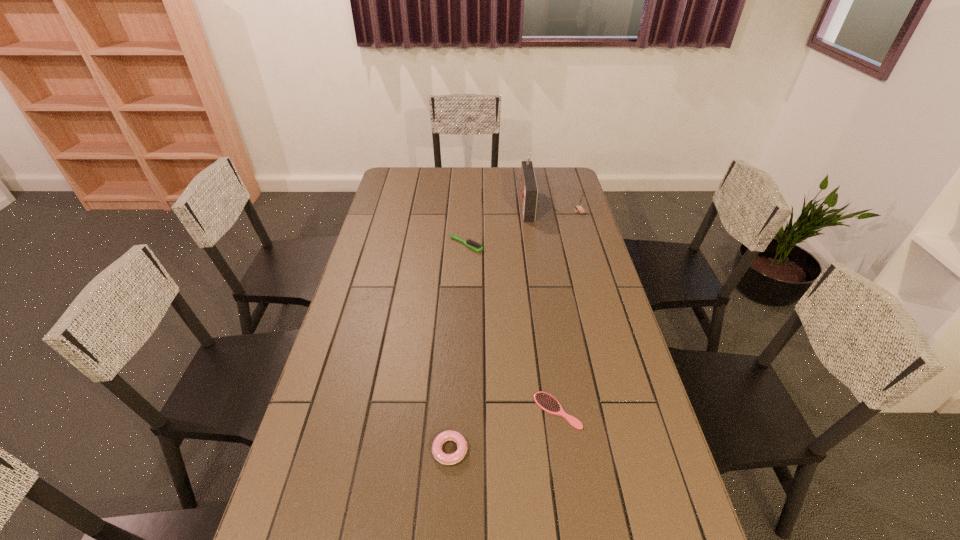
Where is `radio receiver`? radio receiver is located at coordinates (528, 187).

I want to click on matchbox, so click(x=579, y=207).

The image size is (960, 540). I want to click on the fourth shortest object, so click(x=579, y=207).

In order to click on the farther hairbrush in this screenshot , I will do 469,243.

Locate an element on the screen. The width and height of the screenshot is (960, 540). the third nearest object is located at coordinates (469, 243).

Locate an element on the screen. the nearest object is located at coordinates (448, 459).

Identify the location of the shortest object. The height and width of the screenshot is (540, 960). (545, 401).

Find the location of a particular element. the right hairbrush is located at coordinates (545, 401).

Find the location of `free space located on the front panel of the tallest object`. free space located on the front panel of the tallest object is located at coordinates (456, 205).

Image resolution: width=960 pixels, height=540 pixels. In order to click on free point located on the front panel of the tallest object in this screenshot , I will do `click(479, 205)`.